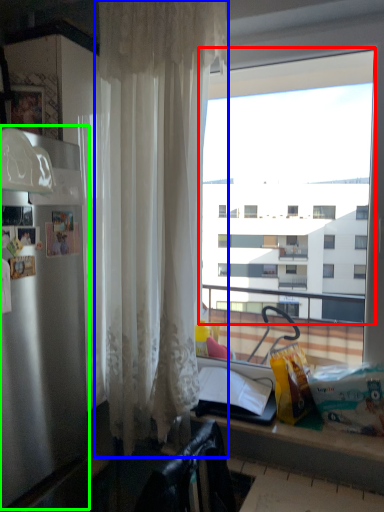
Question: Based on their relative distances, which object is nearer to window (highlighted by a red box)? Choose from curtain (highlighted by a blue box) and appliance (highlighted by a green box).

Choices:
 (A) curtain
 (B) appliance

Answer: (A)